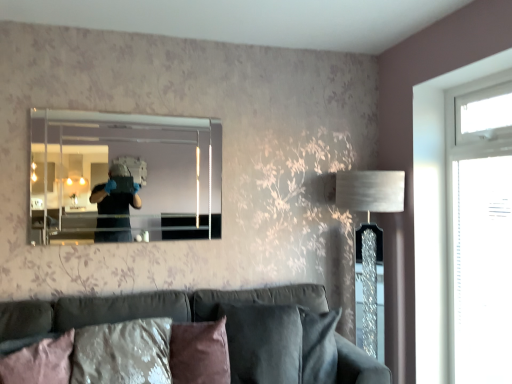
Question: Relative to transparent glass door at right, is brown suede pillow at lower center, the first pillow viewed from the right, in front or behind?

Choices:
 (A) behind
 (B) front

Answer: (B)

Question: Is brown suede pillow at lower center, the 2th pillow when ordered from left to right, situated inside transparent glass door at right or outside?

Choices:
 (A) outside
 (B) inside

Answer: (A)

Question: Which is farther from the transparent glass window at right?

Choices:
 (A) velvet dark gray couch at lower center
 (B) pink fabric pillow at lower left, acting as the 1th pillow starting from the left
 (C) transparent glass door at right
 (D) brown suede pillow at lower center, the first pillow viewed from the right
 (E) silver textured lampshade at right

Answer: (B)

Question: Which of these objects is positioned farthest from the silver textured lampshade at right?

Choices:
 (A) velvet dark gray couch at lower center
 (B) pink fabric pillow at lower left, acting as the second pillow starting from the right
 (C) transparent glass door at right
 (D) brown suede pillow at lower center, the first pillow viewed from the right
 (E) clear glass mirror at upper center

Answer: (B)